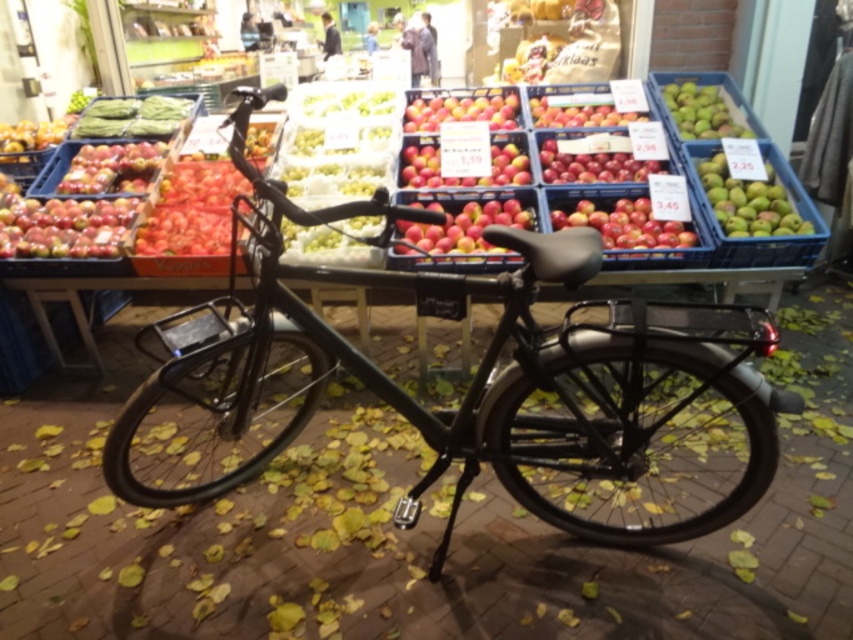
Question: Estimate the real-world distances between objects in this image. Which object is farther from the matte red apple at left?

Choices:
 (A) matte black basket at right
 (B) red matte apples at center
 (C) matte black bicycle at center
 (D) red matte apple at center

Answer: (A)

Question: Among these objects, which one is farthest from the camera?

Choices:
 (A) matte black basket at right
 (B) green matte apple at upper right

Answer: (B)

Question: Among these objects, which one is nearest to the camera?

Choices:
 (A) green matte apple at upper right
 (B) matte black basket at right

Answer: (B)

Question: Is matte black bicycle at center closer to camera compared to green matte apple at upper right?

Choices:
 (A) yes
 (B) no

Answer: (A)

Question: Does matte black bicycle at center appear on the right side of red matte apples at center?

Choices:
 (A) no
 (B) yes

Answer: (A)

Question: Can you confirm if matte black bicycle at center is smaller than matte black basket at right?

Choices:
 (A) no
 (B) yes

Answer: (A)